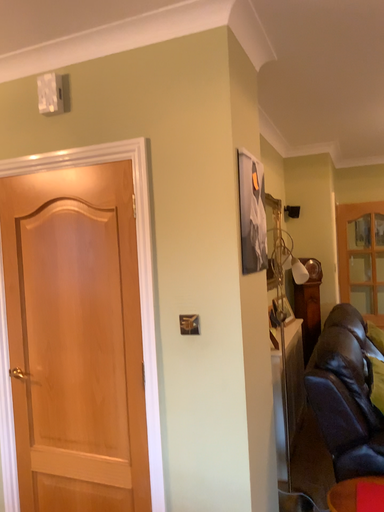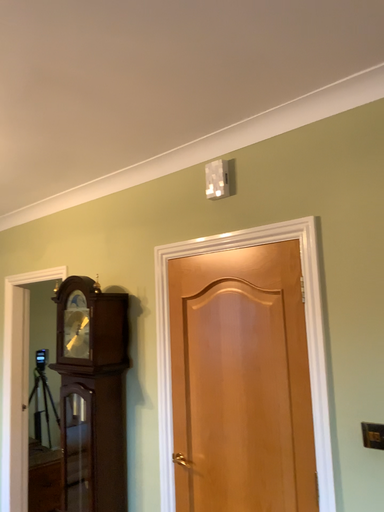
Question: How did the camera likely rotate when shooting the video?

Choices:
 (A) rotated downward
 (B) rotated upward

Answer: (B)